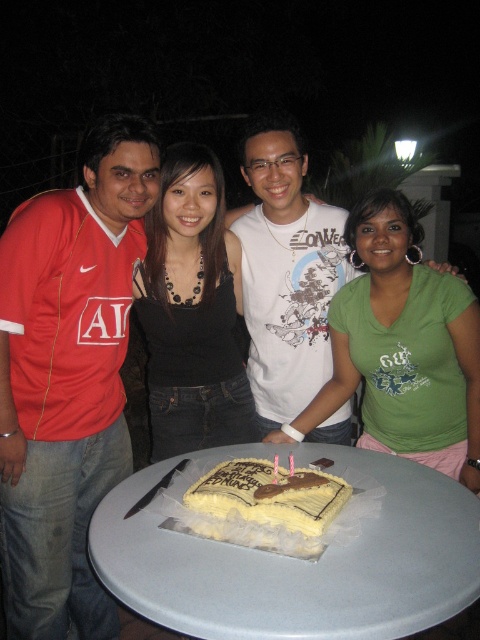
Question: Can you confirm if matte red jersey at left is positioned above white plastic table at center?

Choices:
 (A) yes
 (B) no

Answer: (A)

Question: Based on their relative distances, which object is farther from the white plastic table at center?

Choices:
 (A) yellow frosted rectangular cake at center
 (B) matte red jersey at left

Answer: (B)

Question: Can you confirm if matte red jersey at left is smaller than white plastic table at center?

Choices:
 (A) yes
 (B) no

Answer: (B)

Question: Estimate the real-world distances between objects in this image. Which object is closer to the white plastic table at center?

Choices:
 (A) yellow frosted rectangular cake at center
 (B) black fabric top at center
 (C) white cotton tank top at center
 (D) matte red jersey at left

Answer: (A)

Question: Considering the relative positions of black fabric top at center and yellow frosted rectangular cake at center in the image provided, where is black fabric top at center located with respect to yellow frosted rectangular cake at center?

Choices:
 (A) above
 (B) below

Answer: (A)

Question: Among these points, which one is nearest to the camera?

Choices:
 (A) (157, 385)
 (B) (262, 492)
 (C) (301, 266)
 (D) (410, 500)

Answer: (B)